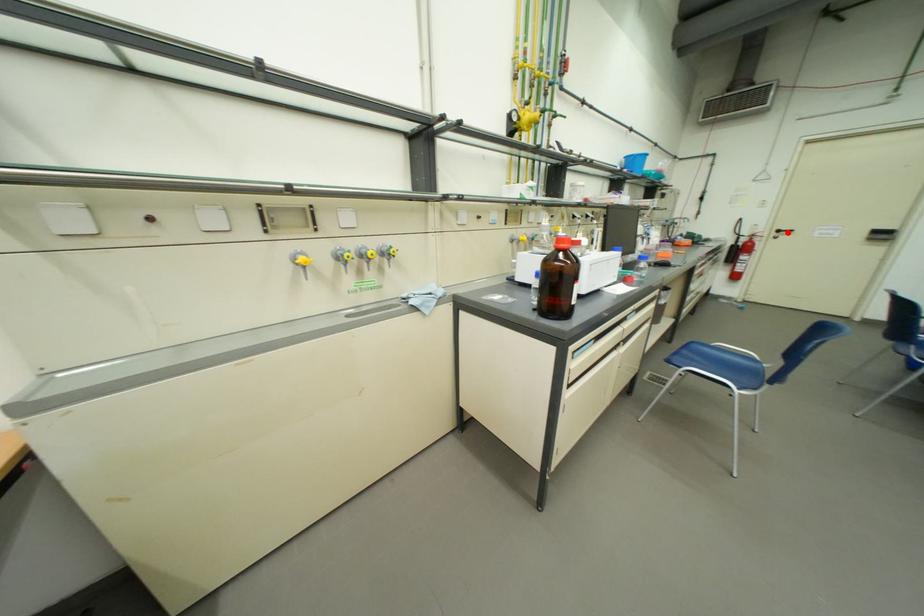
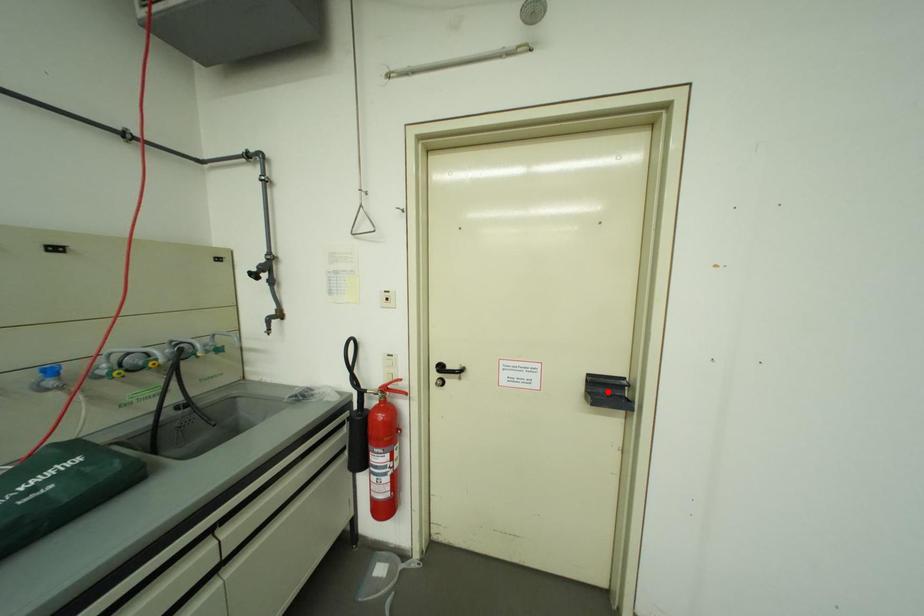
I am providing you with two images of the same scene from different viewpoints. A red point is marked on the first image and another point is marked on the second image. Do the highlighted points in image1 and image2 indicate the same real-world spot?

No